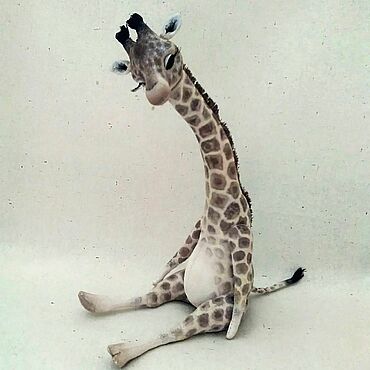
What are the coordinates of `giraffe teddy bear` in the screenshot? It's located at click(x=212, y=236).